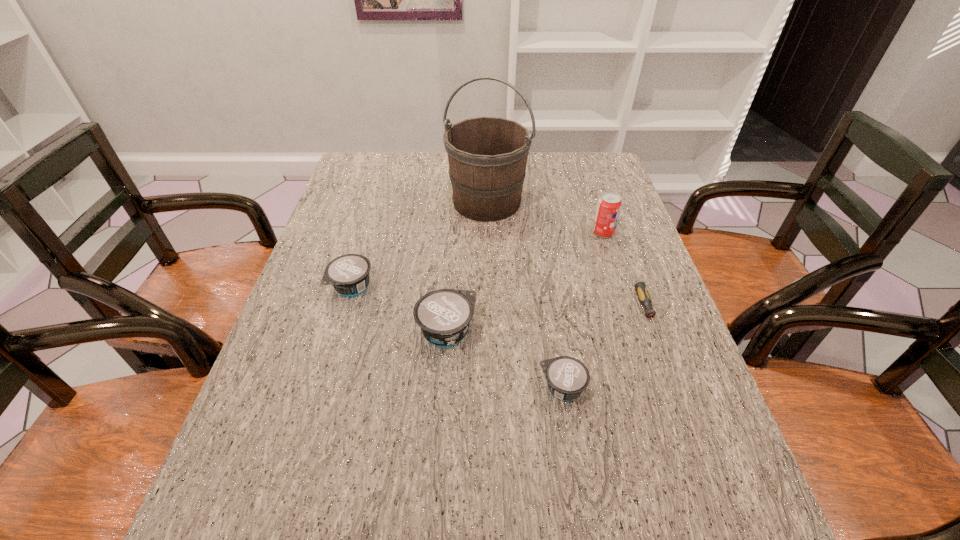
Locate an element on the screen. free area in between the shortest object and the fourth tallest object is located at coordinates (501, 302).

At what (x,y) coordinates should I click in order to perform the action: click on vacant space that is in between the bucket and the farthest yogurt. Please return your answer as a coordinate pair (x, y). Looking at the image, I should click on (420, 245).

At what (x,y) coordinates should I click in order to perform the action: click on free area in between the soda can and the shortest yogurt. Please return your answer as a coordinate pair (x, y). This screenshot has width=960, height=540. Looking at the image, I should click on (583, 310).

Image resolution: width=960 pixels, height=540 pixels. In order to click on free area in between the shortest yogurt and the second nearest yogurt in this screenshot , I will do `click(504, 360)`.

Find the location of a particular element. This screenshot has width=960, height=540. free spot between the bucket and the fifth shortest object is located at coordinates (545, 217).

Find the location of `the closest object to the bucket`. the closest object to the bucket is located at coordinates coord(609,205).

Locate which object is the closest to the nearest yogurt. Please provide its 2D coordinates. Your answer should be formatted as a tuple, i.e. [(x, y)], where the tuple contains the x and y coordinates of a point satisfying the conditions above.

[(443, 315)]

This screenshot has width=960, height=540. Identify the location of yogurt that is the closest to the fifth shortest object. (443, 315).

Point out which yogurt is positioned as the second nearest to the third shortest object. Please provide its 2D coordinates. Your answer should be formatted as a tuple, i.e. [(x, y)], where the tuple contains the x and y coordinates of a point satisfying the conditions above.

[(567, 377)]

Where is `vacant space that satisfies the following two spatial constraints: 1. on the back side of the shortest yogurt; 2. on the left side of the second tallest object`? vacant space that satisfies the following two spatial constraints: 1. on the back side of the shortest yogurt; 2. on the left side of the second tallest object is located at coordinates (539, 233).